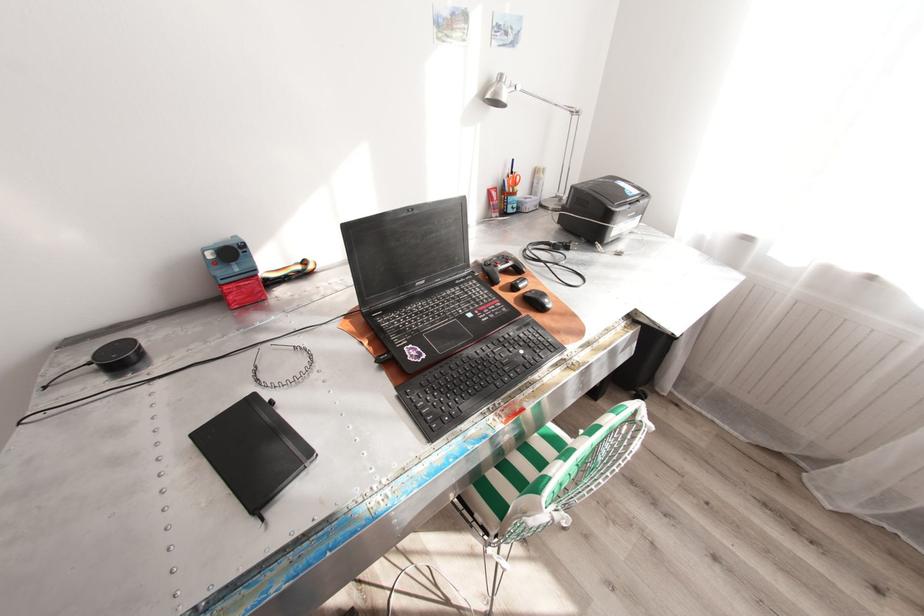
Find where to click the black computer mouse. Please return your answer as a coordinate pair (x, y).

(537, 300)